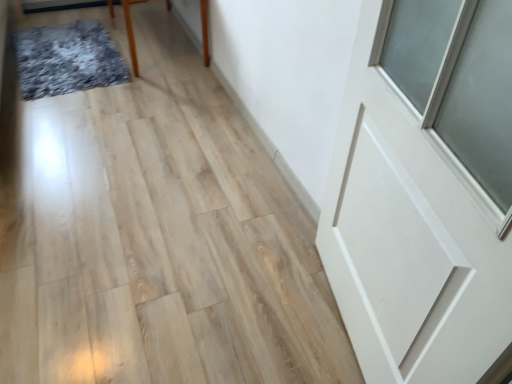
At what (x,y) coordinates should I click in order to perform the action: click on vacant space that's between white matte door at upper right and textured gray mat at upper left. Please return your answer as a coordinate pair (x, y). This screenshot has height=384, width=512. Looking at the image, I should click on [x=198, y=192].